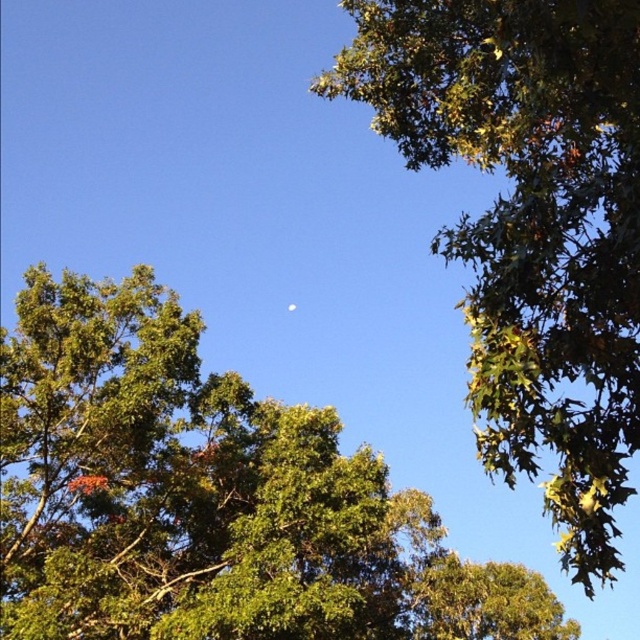
Question: Where is green leafy tree at center located in relation to white glossy moon at center in the image?

Choices:
 (A) left
 (B) right

Answer: (B)

Question: Which of these objects is positioned farthest from the green leafy tree at center?

Choices:
 (A) white glossy moon at center
 (B) green leafy tree at upper right

Answer: (A)

Question: Is the position of green leafy tree at center less distant than that of green leafy tree at upper right?

Choices:
 (A) yes
 (B) no

Answer: (B)

Question: From the image, what is the correct spatial relationship of green leafy tree at center in relation to white glossy moon at center?

Choices:
 (A) above
 (B) below

Answer: (B)

Question: Among these objects, which one is farthest from the camera?

Choices:
 (A) white glossy moon at center
 (B) green leafy tree at upper right
 (C) green leafy tree at center

Answer: (A)

Question: Which point appears farthest from the camera in this image?

Choices:
 (A) (618, 16)
 (B) (28, 516)

Answer: (B)